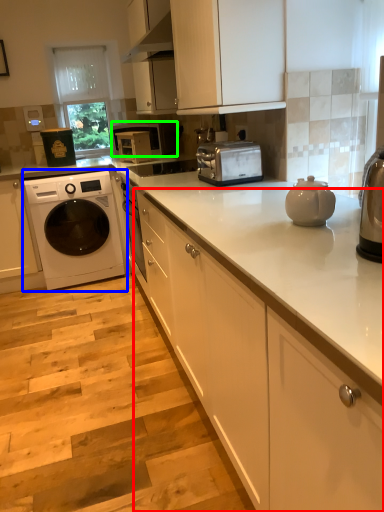
Question: Which is farther away from cabinetry (highlighted by a red box)? washing machine (highlighted by a blue box) or microwave oven (highlighted by a green box)?

Choices:
 (A) washing machine
 (B) microwave oven

Answer: (B)